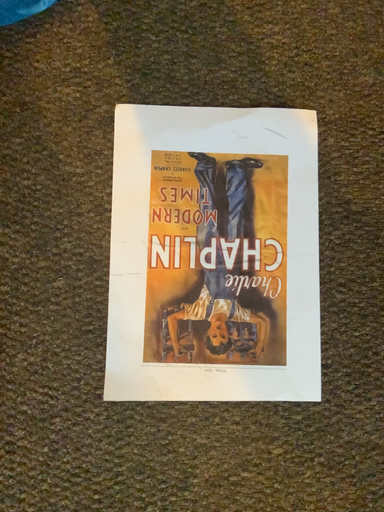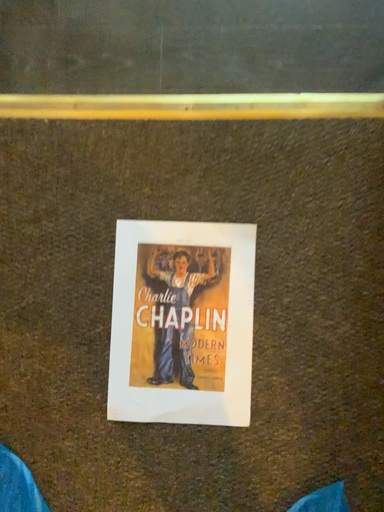
Question: How did the camera likely rotate when shooting the video?

Choices:
 (A) rotated downward
 (B) rotated upward

Answer: (B)